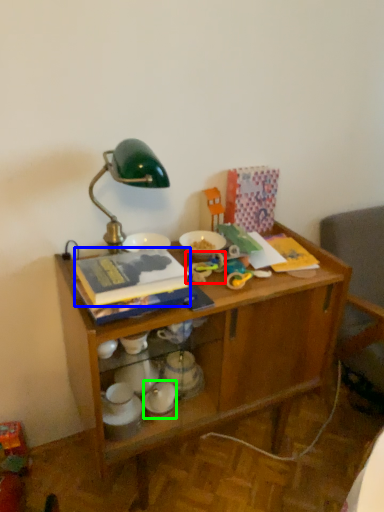
Question: Which object is positioned farthest from toy (highlighted by a red box)? Select from paperback book (highlighted by a blue box) and tableware (highlighted by a green box).

Choices:
 (A) paperback book
 (B) tableware

Answer: (B)